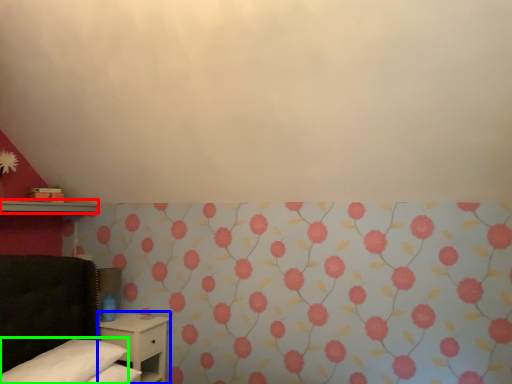
Question: Which is farther away from shelf (highlighted by a red box)? nightstand (highlighted by a blue box) or pillow (highlighted by a green box)?

Choices:
 (A) nightstand
 (B) pillow

Answer: (B)